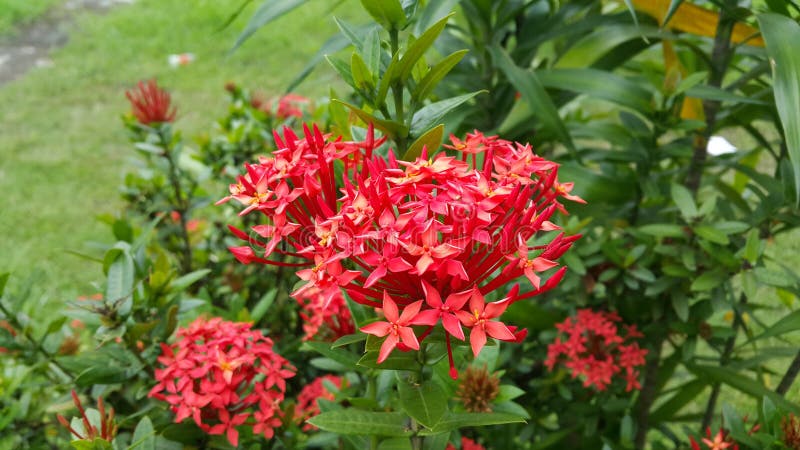
Locate an element on the screen. The height and width of the screenshot is (450, 800). single flower bunch is located at coordinates (153, 103).